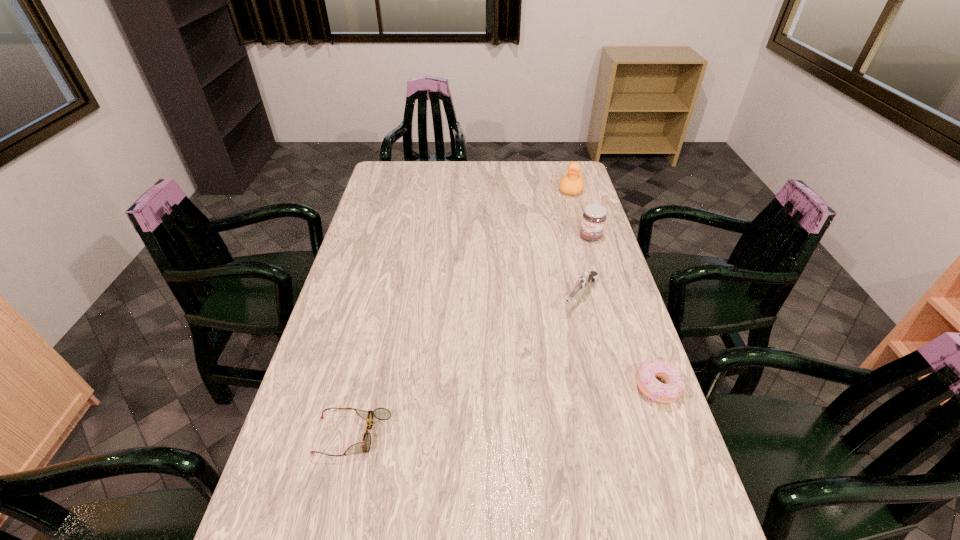
What are the coordinates of `empty space that is in between the second shortest object and the duck` in the screenshot? It's located at (614, 288).

Where is `object that is the fourth closest to the doughnut`? The height and width of the screenshot is (540, 960). object that is the fourth closest to the doughnut is located at coordinates (572, 183).

Choose which object is the second nearest neighbor to the doughnut. Please provide its 2D coordinates. Your answer should be formatted as a tuple, i.e. [(x, y)], where the tuple contains the x and y coordinates of a point satisfying the conditions above.

[(594, 216)]

Where is `vacant space that satisfies the following two spatial constraints: 1. on the back side of the jam; 2. on the right side of the third tallest object`? This screenshot has height=540, width=960. vacant space that satisfies the following two spatial constraints: 1. on the back side of the jam; 2. on the right side of the third tallest object is located at coordinates (566, 237).

Locate an element on the screen. The width and height of the screenshot is (960, 540). free point that satisfies the following two spatial constraints: 1. on the front side of the duck; 2. on the left side of the fourth farthest object is located at coordinates 628,387.